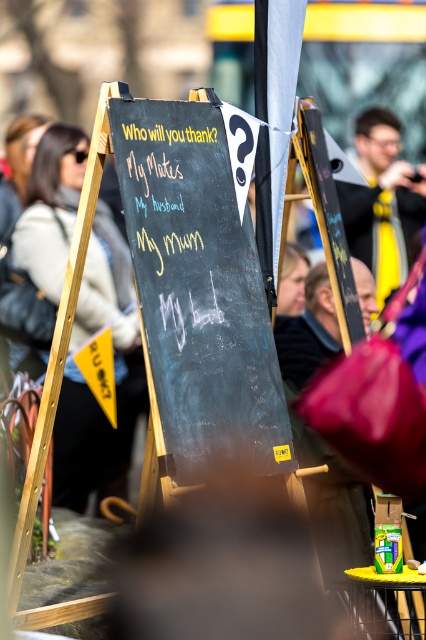
Question: Which point is farther from the camera taking this photo?

Choices:
 (A) (213, 396)
 (B) (63, 145)

Answer: (B)

Question: Which point is closer to the camera taking this photo?

Choices:
 (A) (158, 179)
 (B) (39, 220)

Answer: (A)

Question: Where is black chalkboard at center located in relation to matte black sign at left in the image?

Choices:
 (A) above
 (B) below

Answer: (A)

Question: Is black chalkboard at center closer to the viewer compared to matte black sign at left?

Choices:
 (A) yes
 (B) no

Answer: (A)

Question: Can you confirm if black chalkboard at center is bigger than matte black sign at left?

Choices:
 (A) yes
 (B) no

Answer: (B)